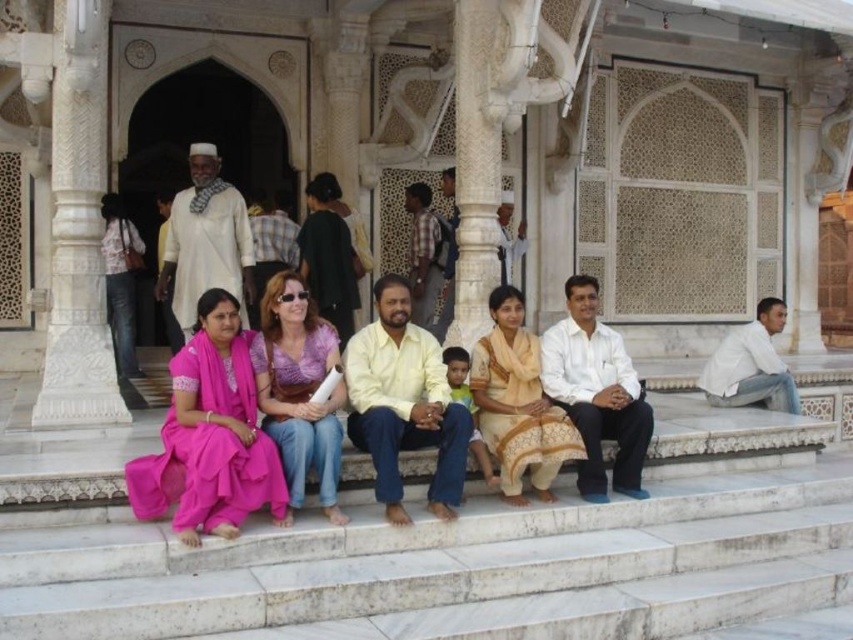
Question: Is white cotton shirt at center above white cotton shirt at right?

Choices:
 (A) no
 (B) yes

Answer: (B)

Question: Which point is closer to the camera?

Choices:
 (A) purple fabric dress at center
 (B) beige cotton saree at center

Answer: (A)

Question: Which point is closer to the camera?

Choices:
 (A) (561, 365)
 (B) (412, 401)
 (C) (270, 374)
 (D) (737, 344)

Answer: (C)

Question: Considering the real-world distances, which object is closest to the purple fabric dress at center?

Choices:
 (A) yellow matte shirt at center
 (B) white cotton shirt at right
 (C) beige cotton saree at center

Answer: (A)

Question: Can you confirm if yellow matte shirt at center is smaller than purple fabric dress at center?

Choices:
 (A) yes
 (B) no

Answer: (B)

Question: In this image, where is yellow matte shirt at center located relative to purple fabric dress at center?

Choices:
 (A) left
 (B) right

Answer: (B)